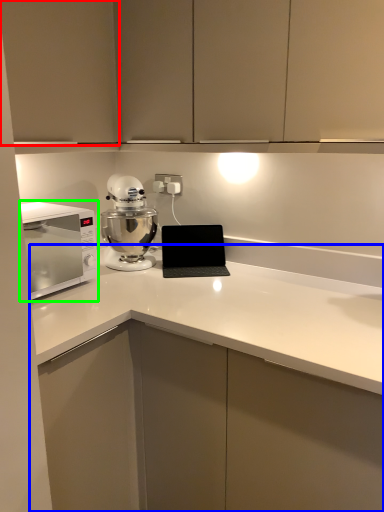
Question: Estimate the real-world distances between objects in this image. Which object is closer to cabinetry (highlighted by a red box), countertop (highlighted by a blue box) or home appliance (highlighted by a green box)?

Choices:
 (A) countertop
 (B) home appliance

Answer: (B)